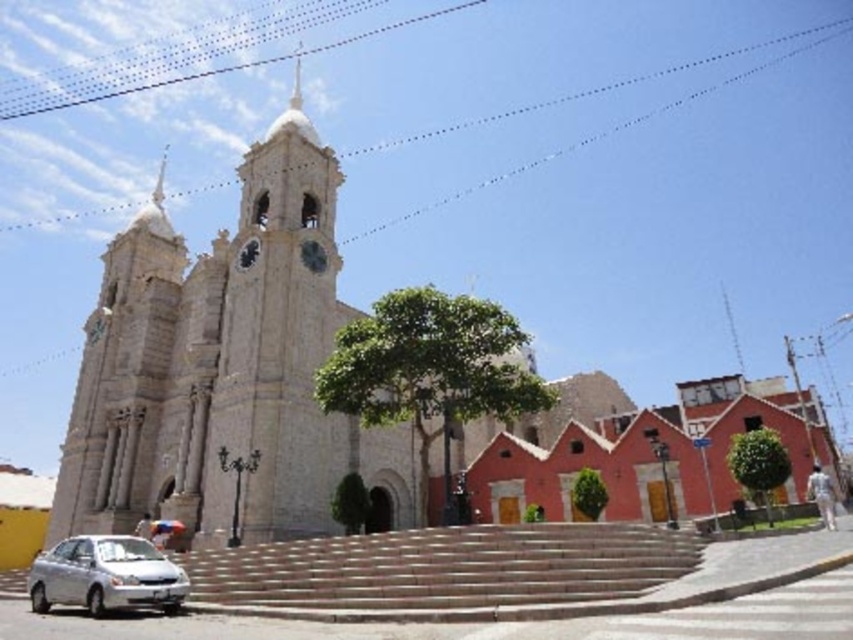
Question: Which point is closer to the camera taking this photo?

Choices:
 (A) (389, 612)
 (B) (94, 604)

Answer: (A)

Question: Which object is closer to the camera taking this photo?

Choices:
 (A) silver metallic car at lower left
 (B) smooth stone stairs at center

Answer: (B)

Question: Is smooth stone stairs at center to the left of silver metallic car at lower left from the viewer's perspective?

Choices:
 (A) no
 (B) yes

Answer: (A)

Question: Where is smooth stone stairs at center located in relation to silver metallic car at lower left in the image?

Choices:
 (A) above
 (B) below

Answer: (A)

Question: Among these objects, which one is farthest from the camera?

Choices:
 (A) silver metallic car at lower left
 (B) smooth stone stairs at center

Answer: (A)

Question: Where is smooth stone stairs at center located in relation to silver metallic car at lower left in the image?

Choices:
 (A) right
 (B) left

Answer: (A)